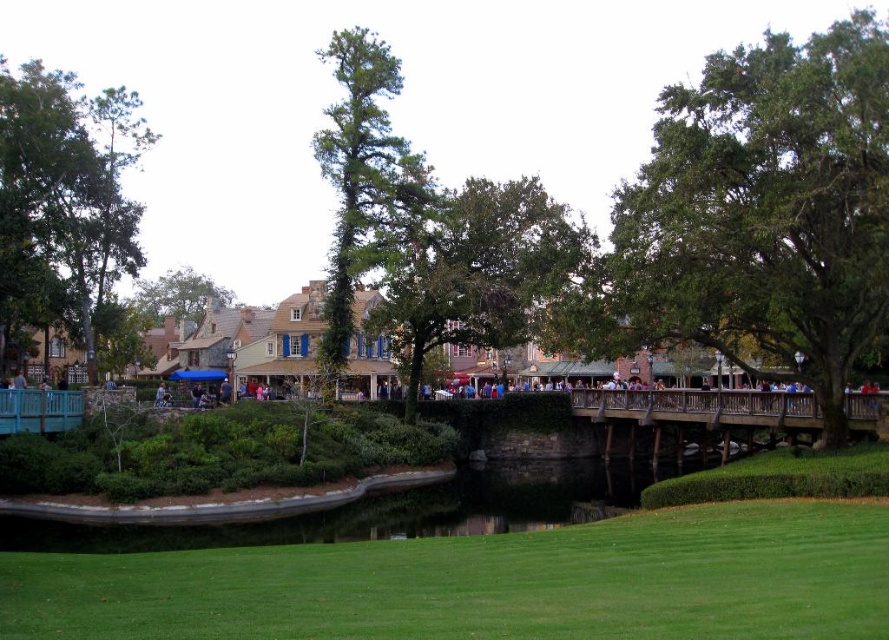
Which is more to the left, green grass at lower center or wooden bridge at center?

Positioned to the left is green grass at lower center.

Which of these two, green grass at lower center or wooden bridge at center, stands taller?

wooden bridge at center

I want to click on green grass at lower center, so click(x=487, y=582).